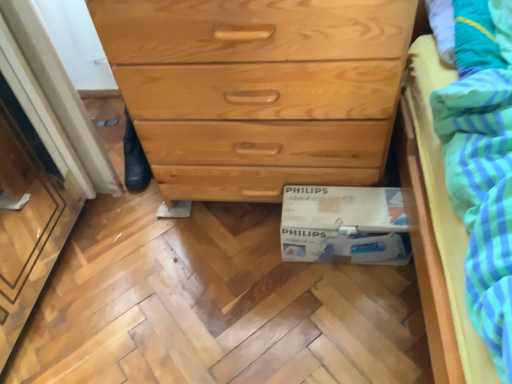
You are a GUI agent. You are given a task and a screenshot of the screen. Output one action in this format:
    pyautogui.click(x=<x>, y=<y>)
    Task: Click on the vacant space that is to the left of natural wood chest of drawers at center
    
    Given the screenshot: What is the action you would take?
    pyautogui.click(x=106, y=236)